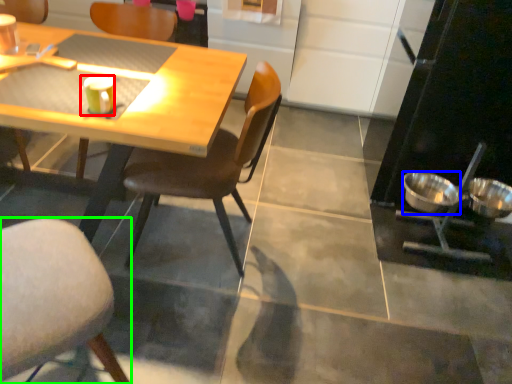
Question: Based on their relative distances, which object is farther from coffee cup (highlighted by a red box)? Choose from bowl (highlighted by a blue box) and chair (highlighted by a green box).

Choices:
 (A) bowl
 (B) chair

Answer: (A)